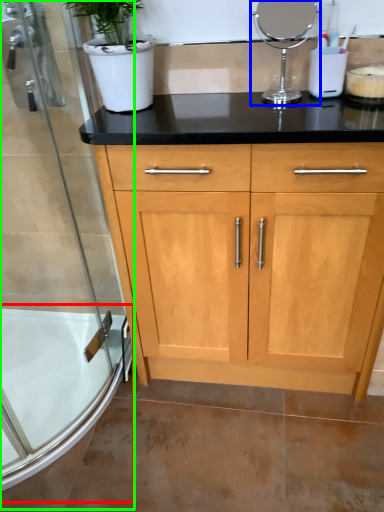
Question: Based on their relative distances, which object is farther from bath (highlighted by a red box)? Choose from appliance (highlighted by a blue box) and shower door (highlighted by a green box).

Choices:
 (A) appliance
 (B) shower door

Answer: (A)